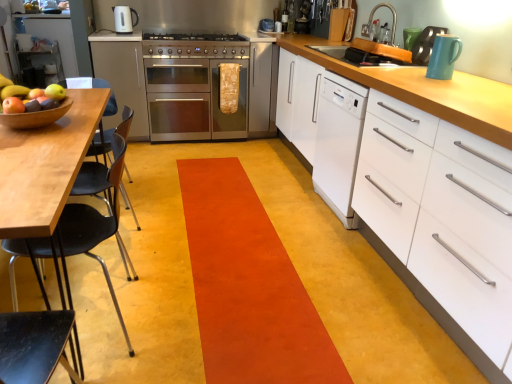
Where is `vacant space behind black plastic chair at left`? vacant space behind black plastic chair at left is located at coordinates (139, 258).